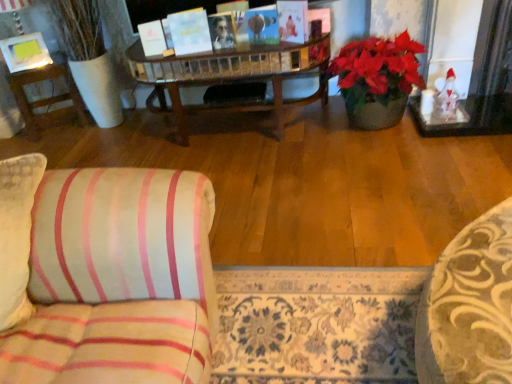
Locate an element on the screen. The height and width of the screenshot is (384, 512). wooden side table at left is located at coordinates (46, 98).

What is the approximate width of wooden side table at left?

33.79 centimeters.

What do you see at coordinates (46, 98) in the screenshot?
I see `wooden side table at left` at bounding box center [46, 98].

The width and height of the screenshot is (512, 384). Find the location of `matte yellow picture frame at upper left`. matte yellow picture frame at upper left is located at coordinates (25, 52).

What is the approximate height of matte yellow picture frame at upper left?

The height of matte yellow picture frame at upper left is 9.63 inches.

The width and height of the screenshot is (512, 384). Describe the element at coordinates (25, 52) in the screenshot. I see `matte yellow picture frame at upper left` at that location.

What are the coordinates of `wooden side table at left` in the screenshot? It's located at (46, 98).

Consider the image. Between matte yellow picture frame at upper left and wooden side table at left, which one appears on the left side from the viewer's perspective?

matte yellow picture frame at upper left is more to the left.

Is the depth of matte yellow picture frame at upper left greater than that of wooden side table at left?

No, matte yellow picture frame at upper left is closer to the camera.

Is point (10, 53) positioned in front of point (18, 85)?

Yes, it is.

From the image's perspective, is matte yellow picture frame at upper left over wooden side table at left?

Yes.

From a real-world perspective, is matte yellow picture frame at upper left physically located above or below wooden side table at left?

matte yellow picture frame at upper left is above wooden side table at left.

Which object is wider, matte yellow picture frame at upper left or wooden side table at left?

Wider between the two is wooden side table at left.

Considering the sizes of matte yellow picture frame at upper left and wooden side table at left in the image, is matte yellow picture frame at upper left taller or shorter than wooden side table at left?

In the image, matte yellow picture frame at upper left appears to be shorter than wooden side table at left.

Consider the image. Who is smaller, matte yellow picture frame at upper left or wooden side table at left?

Smaller between the two is matte yellow picture frame at upper left.

Can we say matte yellow picture frame at upper left lies outside wooden side table at left?

Yes, matte yellow picture frame at upper left is outside of wooden side table at left.

Is matte yellow picture frame at upper left positioned far away from wooden side table at left?

No, there isn't a large distance between matte yellow picture frame at upper left and wooden side table at left.

Is matte yellow picture frame at upper left aimed at wooden side table at left?

No, matte yellow picture frame at upper left is not oriented towards wooden side table at left.

What's the angular difference between matte yellow picture frame at upper left and wooden side table at left's facing directions?

The angle between the facing direction of matte yellow picture frame at upper left and the facing direction of wooden side table at left is 2.28 degrees.

Locate an element on the screen. picture frame that is in front of the wooden side table at left is located at coordinates (25, 52).

Which object is positioned more to the left, wooden side table at left or matte yellow picture frame at upper left?

matte yellow picture frame at upper left.

Which is in front, wooden side table at left or matte yellow picture frame at upper left?

matte yellow picture frame at upper left is closer to the camera.

Is point (19, 83) farther from camera compared to point (17, 39)?

No, (19, 83) is in front of (17, 39).

From the image's perspective, which is below, wooden side table at left or matte yellow picture frame at upper left?

wooden side table at left appears lower in the image.

From a real-world perspective, is wooden side table at left physically located above or below matte yellow picture frame at upper left?

wooden side table at left is below matte yellow picture frame at upper left.

Which of these two, wooden side table at left or matte yellow picture frame at upper left, is thinner?

matte yellow picture frame at upper left is thinner.

Does wooden side table at left have a greater height compared to matte yellow picture frame at upper left?

Yes.

Considering the sizes of wooden side table at left and matte yellow picture frame at upper left in the image, is wooden side table at left bigger or smaller than matte yellow picture frame at upper left?

Considering their sizes, wooden side table at left takes up more space than matte yellow picture frame at upper left.

Is wooden side table at left inside the boundaries of matte yellow picture frame at upper left, or outside?

The correct answer is: outside.

Is wooden side table at left next to matte yellow picture frame at upper left and touching it?

No.

Does wooden side table at left turn towards matte yellow picture frame at upper left?

No, wooden side table at left is not turned towards matte yellow picture frame at upper left.

How different are the orientations of wooden side table at left and matte yellow picture frame at upper left in degrees?

2.28 degrees.

You are a GUI agent. You are given a task and a screenshot of the screen. Output one action in this format:
    pyautogui.click(x=<x>, y=<y>)
    Task: Click on the picture frame above the wooden side table at left (from a real-world perspective)
    
    Given the screenshot: What is the action you would take?
    pyautogui.click(x=25, y=52)

Locate an element on the screen. The width and height of the screenshot is (512, 384). picture frame on the left of wooden side table at left is located at coordinates (25, 52).

Identify the location of side table located on the right of matte yellow picture frame at upper left. (46, 98).